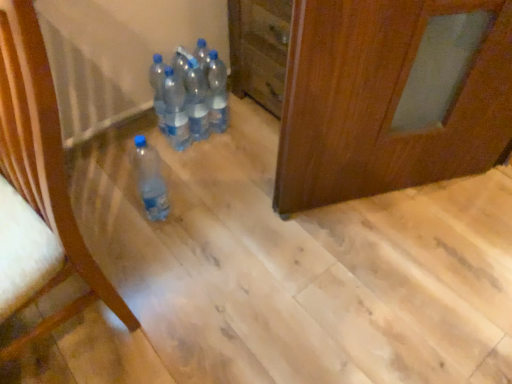
Find the location of `free spot in front of translucent plastic bottles at center, placed as the 2th bottle when sorted from right to left`. free spot in front of translucent plastic bottles at center, placed as the 2th bottle when sorted from right to left is located at coordinates (202, 165).